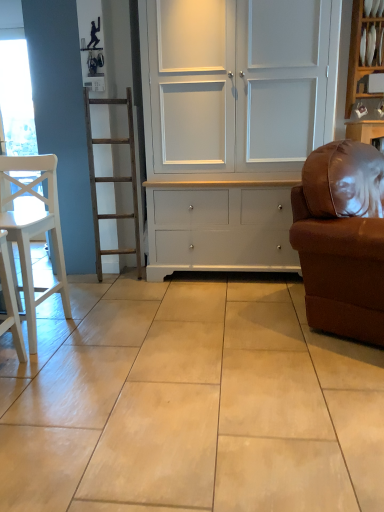
Question: Is white matte chair at left shorter than white painted wood cupboard at center?

Choices:
 (A) no
 (B) yes

Answer: (B)

Question: Is the depth of white matte chair at left greater than that of white painted wood cupboard at center?

Choices:
 (A) yes
 (B) no

Answer: (B)

Question: Does white matte chair at left appear on the left side of white painted wood cupboard at center?

Choices:
 (A) yes
 (B) no

Answer: (A)

Question: Is white matte chair at left not close to white painted wood cupboard at center?

Choices:
 (A) no
 (B) yes

Answer: (B)

Question: From a real-world perspective, is white matte chair at left below white painted wood cupboard at center?

Choices:
 (A) yes
 (B) no

Answer: (A)

Question: Is brown leather couch at right taller or shorter than white glossy shelf at upper right?

Choices:
 (A) tall
 (B) short

Answer: (A)

Question: From a real-world perspective, is brown leather couch at right positioned above or below white glossy shelf at upper right?

Choices:
 (A) above
 (B) below

Answer: (B)

Question: Looking at their shapes, would you say brown leather couch at right is wider or thinner than white glossy shelf at upper right?

Choices:
 (A) wide
 (B) thin

Answer: (A)

Question: Considering the positions of point (380, 177) and point (375, 74), is point (380, 177) closer or farther from the camera than point (375, 74)?

Choices:
 (A) closer
 (B) farther

Answer: (A)

Question: Looking at their shapes, would you say white painted wood cupboard at center is wider or thinner than white matte chair at left?

Choices:
 (A) thin
 (B) wide

Answer: (B)

Question: From a real-world perspective, relative to white matte chair at left, is white painted wood cupboard at center vertically above or below?

Choices:
 (A) above
 (B) below

Answer: (A)

Question: From the image's perspective, is white painted wood cupboard at center positioned above or below white matte chair at left?

Choices:
 (A) below
 (B) above

Answer: (B)

Question: Is white painted wood cupboard at center taller or shorter than white matte chair at left?

Choices:
 (A) short
 (B) tall

Answer: (B)

Question: In the image, is white matte chair at left positioned in front of or behind brown leather couch at right?

Choices:
 (A) behind
 (B) front

Answer: (A)

Question: From a real-world perspective, is white matte chair at left physically located above or below brown leather couch at right?

Choices:
 (A) below
 (B) above

Answer: (A)